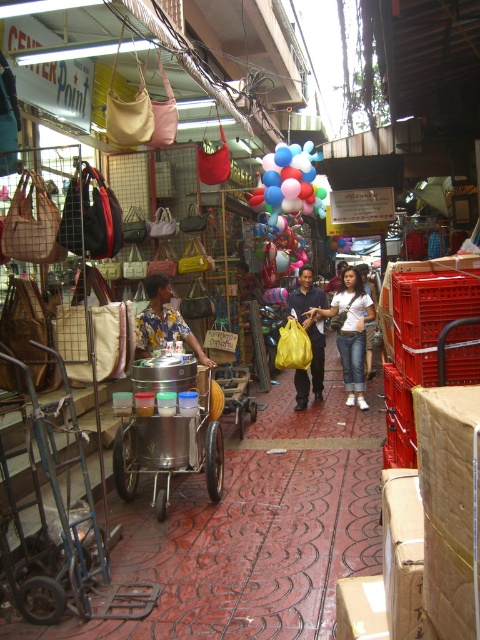
What do you see at coordinates (168, 435) in the screenshot?
I see `brushed metal cart at center` at bounding box center [168, 435].

Which is behind, point (144, 445) or point (154, 330)?

The point (154, 330) is more distant.

Does point (119, 484) come behind point (192, 348)?

No.

Where is `brushed metal cart at center`? The height and width of the screenshot is (640, 480). brushed metal cart at center is located at coordinates (168, 435).

Is multicolored balloons at center bigger than floral shirt at center?

Correct, multicolored balloons at center is larger in size than floral shirt at center.

Is multicolored balloons at center further to camera compared to floral shirt at center?

Yes, it is behind floral shirt at center.

Is point (283, 141) positioned before point (182, 321)?

No, (283, 141) is further to viewer.

The image size is (480, 640). Identify the location of multicolored balloons at center. (289, 182).

Who is more distant from viewer, (354, 401) or (142, 340)?

The point (354, 401) is more distant.

Between point (338, 305) and point (156, 317), which one is positioned in front?

Point (156, 317)

The image size is (480, 640). In order to click on white cotton shirt at center in this screenshot , I will do `click(350, 332)`.